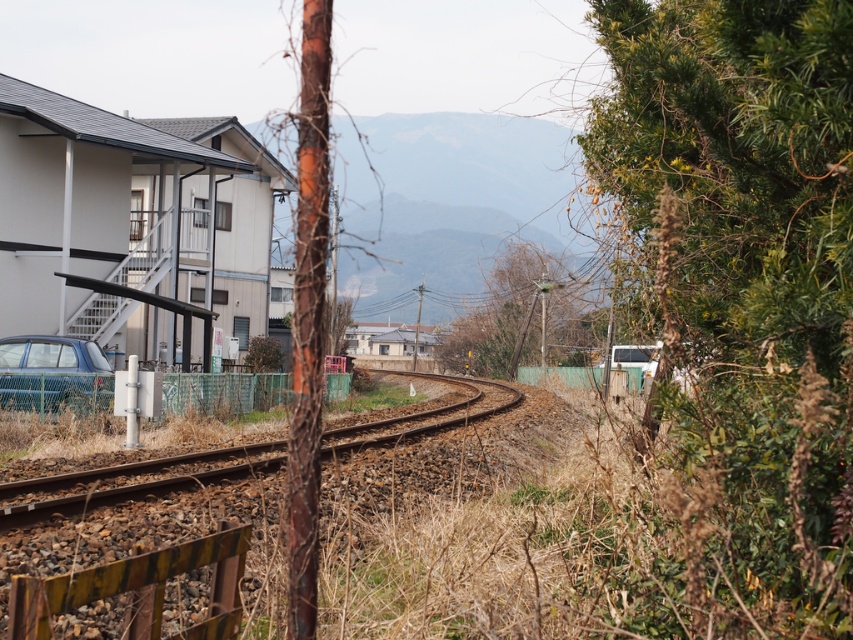
Can you confirm if bare branches at center is wider than brown gravel track at center?

Yes.

Can you confirm if bare branches at center is smaller than brown gravel track at center?

No, bare branches at center is not smaller than brown gravel track at center.

Between point (521, 326) and point (21, 486), which one is positioned behind?

The point (521, 326) is behind.

This screenshot has width=853, height=640. I want to click on bare branches at center, so click(x=524, y=316).

Can you confirm if brown gravel track at center is taller than matte blue hatchback at lower left?

Correct, brown gravel track at center is much taller as matte blue hatchback at lower left.

Between point (6, 497) and point (91, 406), which one is positioned in front?

Point (6, 497)

This screenshot has width=853, height=640. Identify the location of brown gravel track at center. (128, 483).

Who is higher up, bare branches at center or matte blue hatchback at lower left?

bare branches at center

Who is more distant from viewer, (445, 340) or (36, 340)?

Positioned behind is point (445, 340).

The image size is (853, 640). Find the location of `bare branches at center`. bare branches at center is located at coordinates (524, 316).